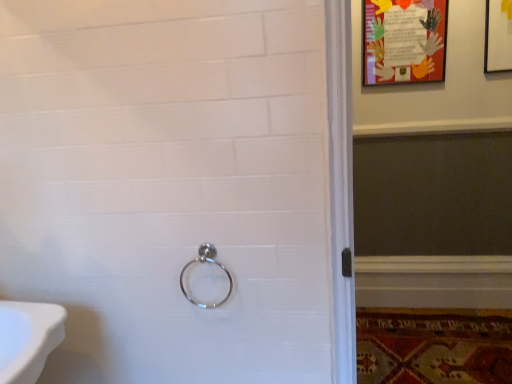
What is the approximate height of colorful paper poster at upper right?

17.25 inches.

The width and height of the screenshot is (512, 384). I want to click on colorful paper poster at upper right, so click(x=404, y=41).

Based on the photo, would you say colorful paper poster at upper right is part of polished metal ring at center's contents?

That's incorrect, colorful paper poster at upper right is not inside polished metal ring at center.

Looking at this image, in terms of height, does polished metal ring at center look taller or shorter compared to colorful paper poster at upper right?

Clearly, polished metal ring at center is shorter compared to colorful paper poster at upper right.

Considering the relative sizes of polished metal ring at center and colorful paper poster at upper right in the image provided, is polished metal ring at center smaller than colorful paper poster at upper right?

Yes, polished metal ring at center is smaller than colorful paper poster at upper right.

Does polished metal ring at center turn towards colorful paper poster at upper right?

No, polished metal ring at center is not oriented towards colorful paper poster at upper right.

Does polished metal ring at center contain carpeted mat at lower right?

No, carpeted mat at lower right is not surrounded by polished metal ring at center.

Is polished metal ring at center placed right next to carpeted mat at lower right?

There is a gap between polished metal ring at center and carpeted mat at lower right.

At what (x,y) coordinates should I click in order to perform the action: click on door handle on the left of carpeted mat at lower right. Please return your answer as a coordinate pair (x, y). Looking at the image, I should click on click(x=207, y=262).

Which point is more forward, (x=435, y=15) or (x=205, y=255)?

The point (x=205, y=255) is in front.

Which is behind, colorful paper poster at upper right or polished metal ring at center?

colorful paper poster at upper right is further away from the camera.

From a real-world perspective, which is physically below, colorful paper poster at upper right or polished metal ring at center?

From a 3D spatial view, polished metal ring at center is below.

Considering the relative sizes of colorful paper poster at upper right and carpeted mat at lower right in the image provided, is colorful paper poster at upper right bigger than carpeted mat at lower right?

No.

Which point is more forward, [386,1] or [438,334]?

Point [386,1]

Measure the distance from colorful paper poster at upper right to carpeted mat at lower right.

colorful paper poster at upper right and carpeted mat at lower right are 1.43 meters apart from each other.

Is colorful paper poster at upper right positioned in front of carpeted mat at lower right?

That is False.

From their relative heights in the image, would you say carpeted mat at lower right is taller or shorter than polished metal ring at center?

In the image, carpeted mat at lower right appears to be shorter than polished metal ring at center.

Find the location of `mat lying behind the polished metal ring at center`. mat lying behind the polished metal ring at center is located at coordinates (434, 346).

From a real-world perspective, which object stands above the other?

From a 3D spatial view, polished metal ring at center is above.

Considering the relative sizes of carpeted mat at lower right and polished metal ring at center in the image provided, is carpeted mat at lower right smaller than polished metal ring at center?

No, carpeted mat at lower right is not smaller than polished metal ring at center.

Which object is thinner, carpeted mat at lower right or colorful paper poster at upper right?

colorful paper poster at upper right.

Considering the relative sizes of carpeted mat at lower right and colorful paper poster at upper right in the image provided, is carpeted mat at lower right shorter than colorful paper poster at upper right?

Yes.

From the image's perspective, is carpeted mat at lower right positioned above or below colorful paper poster at upper right?

carpeted mat at lower right is below colorful paper poster at upper right.

Is carpeted mat at lower right at the left side of colorful paper poster at upper right?

No, carpeted mat at lower right is not to the left of colorful paper poster at upper right.

Find the location of a particular element. door handle below the colorful paper poster at upper right (from the image's perspective) is located at coordinates (207, 262).

Find the location of a particular element. Image resolution: width=512 pixels, height=384 pixels. door handle in front of the carpeted mat at lower right is located at coordinates (207, 262).

Based on their spatial positions, is carpeted mat at lower right or colorful paper poster at upper right further from polished metal ring at center?

Based on the image, colorful paper poster at upper right appears to be further to polished metal ring at center.

Which object lies nearer to the anchor point carpeted mat at lower right, colorful paper poster at upper right or polished metal ring at center?

colorful paper poster at upper right is closer to carpeted mat at lower right.

Looking at the image, which one is located closer to colorful paper poster at upper right, polished metal ring at center or carpeted mat at lower right?

The object closer to colorful paper poster at upper right is carpeted mat at lower right.

Which object lies nearer to the anchor point polished metal ring at center, colorful paper poster at upper right or carpeted mat at lower right?

The object closer to polished metal ring at center is carpeted mat at lower right.

From the image, which object appears to be nearer to carpeted mat at lower right, polished metal ring at center or colorful paper poster at upper right?

colorful paper poster at upper right is closer to carpeted mat at lower right.

Considering their positions, is carpeted mat at lower right positioned closer to colorful paper poster at upper right than polished metal ring at center?

Among the two, carpeted mat at lower right is located nearer to colorful paper poster at upper right.

Where is `door handle that lies between colorful paper poster at upper right and carpeted mat at lower right from top to bottom`? This screenshot has height=384, width=512. door handle that lies between colorful paper poster at upper right and carpeted mat at lower right from top to bottom is located at coordinates (207, 262).